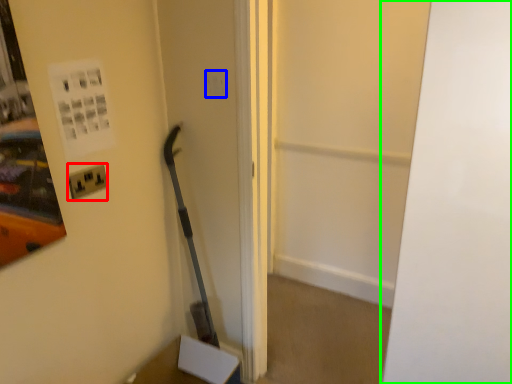
Question: Based on their relative distances, which object is farther from electric outlet (highlighted by a red box)? Choose from light switch (highlighted by a blue box) and door (highlighted by a green box).

Choices:
 (A) light switch
 (B) door

Answer: (B)